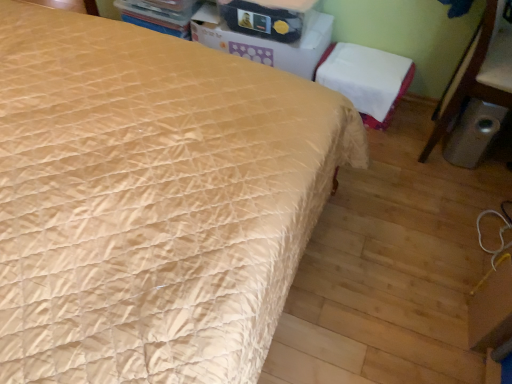
Describe the element at coordinates (481, 72) in the screenshot. I see `metallic trash can at lower right` at that location.

What do you see at coordinates (267, 42) in the screenshot?
I see `white cardboard box at upper center` at bounding box center [267, 42].

This screenshot has width=512, height=384. I want to click on white fabric chair at upper right, so click(366, 79).

Which of these two, matte cardboard box at upper center or metallic trash can at lower right, is wider?

With larger width is metallic trash can at lower right.

Is matte cardboard box at upper center located outside metallic trash can at lower right?

Yes, matte cardboard box at upper center is located beyond the bounds of metallic trash can at lower right.

From the image's perspective, is matte cardboard box at upper center positioned above or below metallic trash can at lower right?

matte cardboard box at upper center is situated higher than metallic trash can at lower right in the image.

Is matte cardboard box at upper center turned away from metallic trash can at lower right?

No.

Is white fabric chair at upper right spatially inside metallic trash can at lower right, or outside of it?

white fabric chair at upper right is outside metallic trash can at lower right.

Consider the image. In the image, is white fabric chair at upper right positioned in front of or behind metallic trash can at lower right?

white fabric chair at upper right is positioned farther from the viewer than metallic trash can at lower right.

Measure the distance between white fabric chair at upper right and metallic trash can at lower right.

The distance of white fabric chair at upper right from metallic trash can at lower right is 14.03 inches.

Based on the photo, which object is wider, white fabric chair at upper right or metallic trash can at lower right?

metallic trash can at lower right.

Between metallic trash can at lower right and white fabric chair at upper right, which one has larger width?

metallic trash can at lower right is wider.

From a real-world perspective, is metallic trash can at lower right located beneath white fabric chair at upper right?

No, from a real-world perspective, metallic trash can at lower right is not beneath white fabric chair at upper right.

From the image's perspective, is metallic trash can at lower right on top of white fabric chair at upper right?

Incorrect, from the image's perspective, metallic trash can at lower right is lower than white fabric chair at upper right.

Is metallic trash can at lower right turned away from white fabric chair at upper right?

Yes, white fabric chair at upper right is at the back of metallic trash can at lower right.

Does point (374, 72) lie in front of point (284, 46)?

Yes, point (374, 72) is closer to viewer.

Would you say white fabric chair at upper right is inside or outside white cardboard box at upper center?

white fabric chair at upper right is located beyond the bounds of white cardboard box at upper center.

Is white fabric chair at upper right facing away from white cardboard box at upper center?

No, white fabric chair at upper right is not facing away from white cardboard box at upper center.

Looking at this image, is metallic trash can at lower right facing away from white cardboard box at upper center?

Absolutely, metallic trash can at lower right is directed away from white cardboard box at upper center.

Is metallic trash can at lower right positioned in front of white cardboard box at upper center?

That is True.

Is metallic trash can at lower right located outside white cardboard box at upper center?

metallic trash can at lower right is positioned outside white cardboard box at upper center.

From the image's perspective, is metallic trash can at lower right located beneath white cardboard box at upper center?

Indeed, from the image's perspective, metallic trash can at lower right is shown beneath white cardboard box at upper center.

Is white fabric chair at upper right located outside matte cardboard box at upper center?

That's correct, white fabric chair at upper right is outside of matte cardboard box at upper center.

From a real-world perspective, is white fabric chair at upper right physically located above or below matte cardboard box at upper center?

From a real-world perspective, white fabric chair at upper right is physically below matte cardboard box at upper center.

Which of these two, white fabric chair at upper right or matte cardboard box at upper center, is thinner?

white fabric chair at upper right is thinner.

Which is behind, white cardboard box at upper center or matte cardboard box at upper center?

white cardboard box at upper center is further away from the camera.

In terms of height, does white cardboard box at upper center look taller or shorter compared to matte cardboard box at upper center?

In the image, white cardboard box at upper center appears to be taller than matte cardboard box at upper center.

Does white cardboard box at upper center have a greater width compared to matte cardboard box at upper center?

Yes.

Is white cardboard box at upper center aimed at matte cardboard box at upper center?

No, white cardboard box at upper center does not turn towards matte cardboard box at upper center.

Image resolution: width=512 pixels, height=384 pixels. What are the coordinates of `furniture below the matte cardboard box at upper center (from the image's perspective)` in the screenshot? It's located at (481, 72).

Image resolution: width=512 pixels, height=384 pixels. In the image, there is a metallic trash can at lower right. Identify the location of chair below it (from a real-world perspective). (366, 79).

Estimate the real-world distances between objects in this image. Which object is further from white cardboard box at upper center, white fabric chair at upper right or matte cardboard box at upper center?

white fabric chair at upper right is further to white cardboard box at upper center.

Considering their positions, is white cardboard box at upper center positioned closer to metallic trash can at lower right than white fabric chair at upper right?

white fabric chair at upper right lies closer to metallic trash can at lower right than the other object.

Which object lies further to the anchor point metallic trash can at lower right, matte cardboard box at upper center or white fabric chair at upper right?

Among the two, matte cardboard box at upper center is located further to metallic trash can at lower right.

Which object lies nearer to the anchor point white cardboard box at upper center, matte cardboard box at upper center or white fabric chair at upper right?

matte cardboard box at upper center.

In the scene shown: Which object lies nearer to the anchor point white fabric chair at upper right, white cardboard box at upper center or metallic trash can at lower right?

white cardboard box at upper center.

When comparing their distances from white cardboard box at upper center, does white fabric chair at upper right or metallic trash can at lower right seem closer?

white fabric chair at upper right is closer to white cardboard box at upper center.

When comparing their distances from metallic trash can at lower right, does white fabric chair at upper right or matte cardboard box at upper center seem closer?

Based on the image, white fabric chair at upper right appears to be nearer to metallic trash can at lower right.

From the image, which object appears to be farther from white cardboard box at upper center, matte cardboard box at upper center or metallic trash can at lower right?

metallic trash can at lower right.

The width and height of the screenshot is (512, 384). Find the location of `storage box situated between white cardboard box at upper center and metallic trash can at lower right from left to right`. storage box situated between white cardboard box at upper center and metallic trash can at lower right from left to right is located at coordinates (262, 21).

Where is `storage box between white cardboard box at upper center and white fabric chair at upper right`? This screenshot has height=384, width=512. storage box between white cardboard box at upper center and white fabric chair at upper right is located at coordinates (262, 21).

The width and height of the screenshot is (512, 384). I want to click on chair between matte cardboard box at upper center and metallic trash can at lower right from left to right, so click(366, 79).

Find the location of `chair situated between white cardboard box at upper center and metallic trash can at lower right from left to right`. chair situated between white cardboard box at upper center and metallic trash can at lower right from left to right is located at coordinates (366, 79).